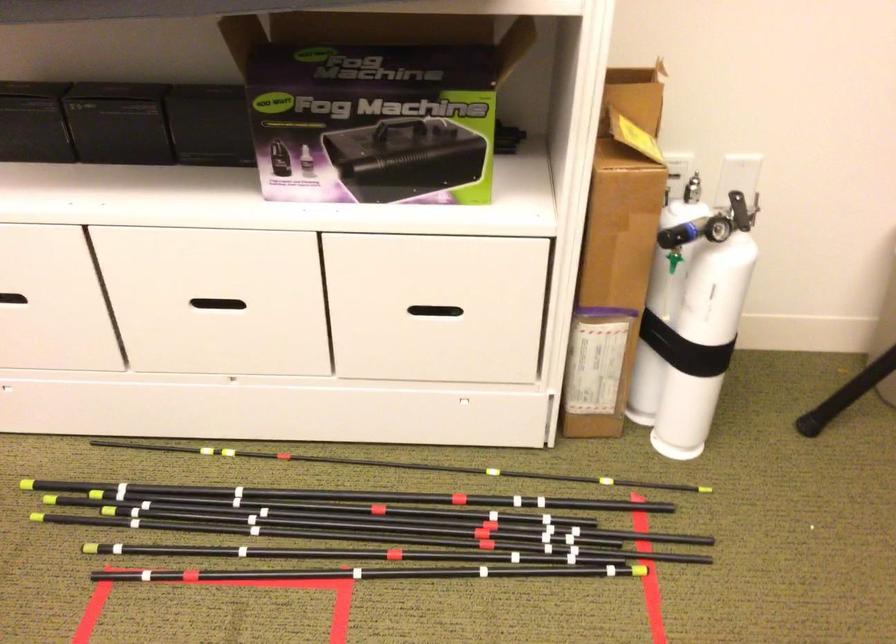
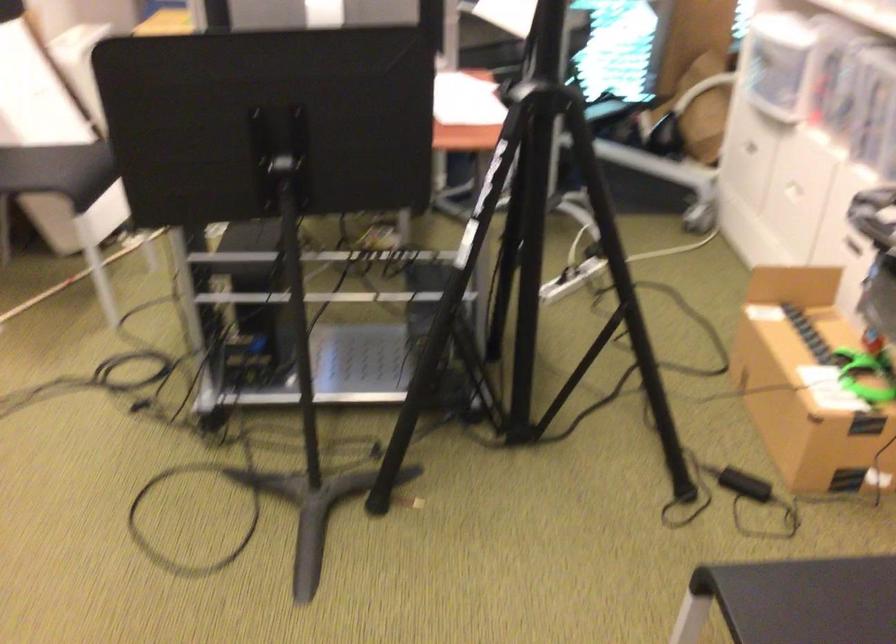
First-person continuous shooting, in which direction is the camera rotating?

The camera rotated toward left-down.